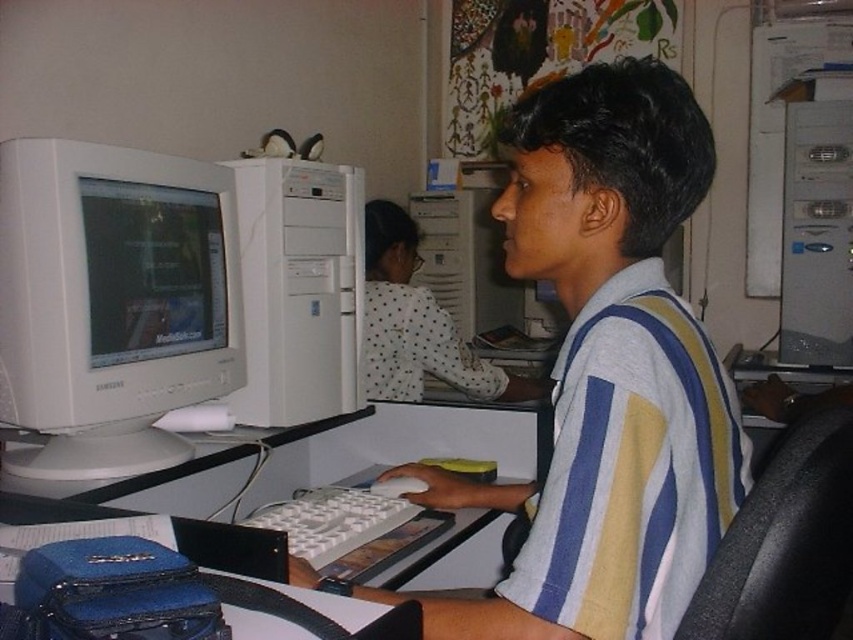
Question: Which is farther from the white glossy computer monitor at left?

Choices:
 (A) white plastic keyboard at center
 (B) matte white monitor at left
 (C) white plastic desktop computer at center
 (D) white matte shirt at center

Answer: (D)

Question: Which point appears closest to the camera in this image?

Choices:
 (A) (312, 513)
 (B) (289, 292)
 (C) (183, 225)
 (D) (683, 464)

Answer: (D)

Question: Does white matte shirt at center lie behind white glossy computer monitor at left?

Choices:
 (A) no
 (B) yes

Answer: (A)

Question: Considering the relative positions of white matte shirt at center and white plastic keyboard at center in the image provided, where is white matte shirt at center located with respect to white plastic keyboard at center?

Choices:
 (A) left
 (B) right

Answer: (B)

Question: Is white glossy computer monitor at left above white plastic desktop computer at center?

Choices:
 (A) no
 (B) yes

Answer: (A)

Question: Estimate the real-world distances between objects in this image. Which object is farther from the white plastic desktop computer at center?

Choices:
 (A) white glossy computer monitor at left
 (B) white plastic keyboard at center

Answer: (B)